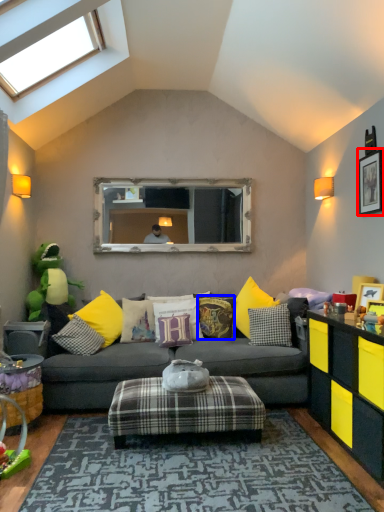
Question: Which of the following is the closest to the observer, picture frame (highlighted by a red box) or pillow (highlighted by a blue box)?

Choices:
 (A) picture frame
 (B) pillow

Answer: (A)